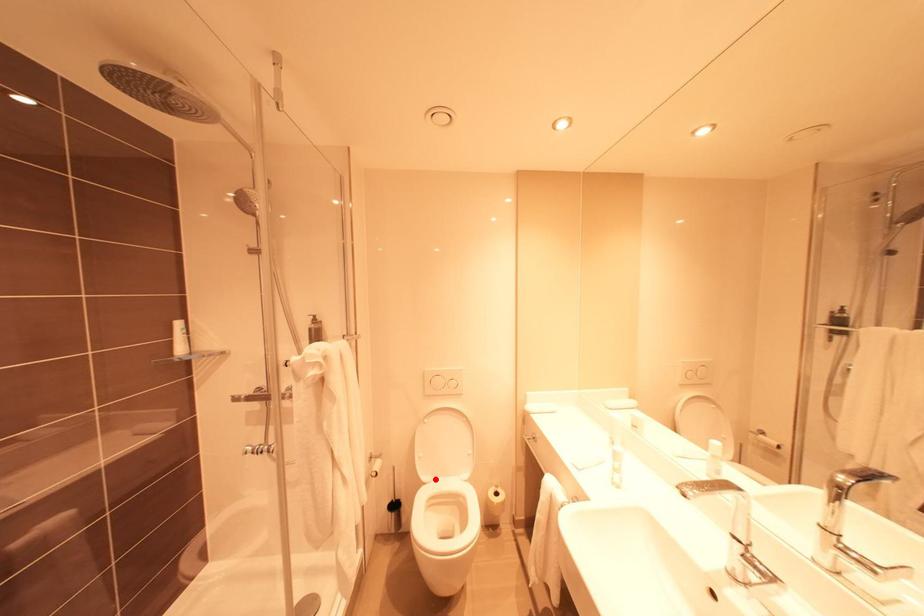
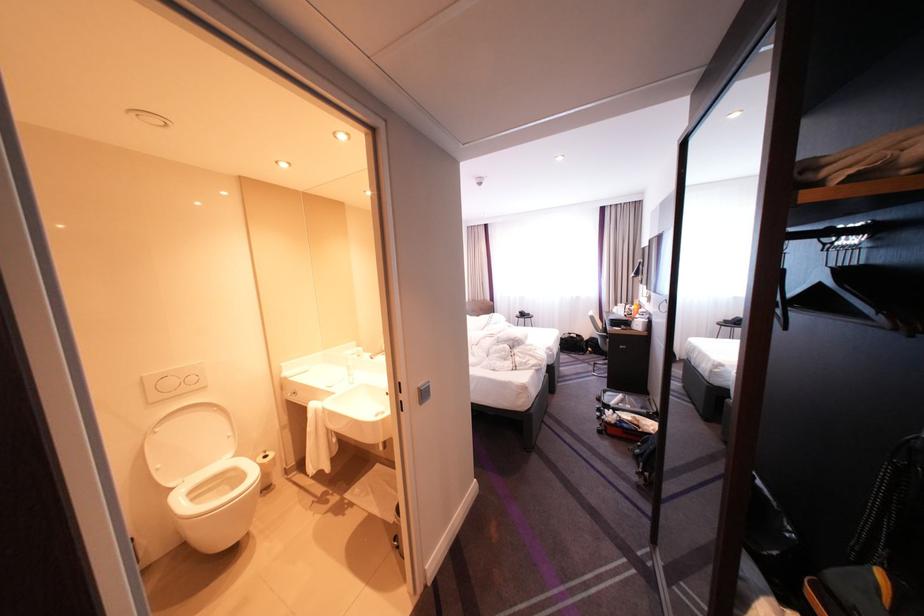
Find the pixel in the second image that matches the highlighted location in the first image.

(183, 485)